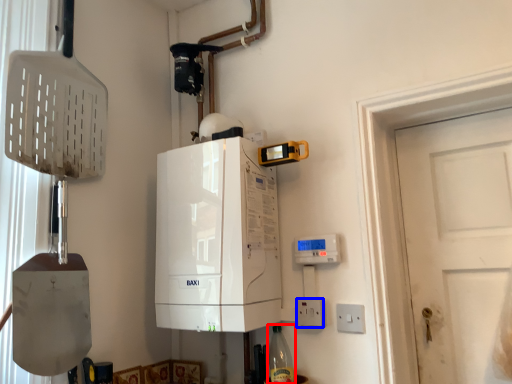
Question: Which object is closer to the camera taking this photo, bottle (highlighted by a red box) or electric outlet (highlighted by a blue box)?

Choices:
 (A) bottle
 (B) electric outlet

Answer: (A)